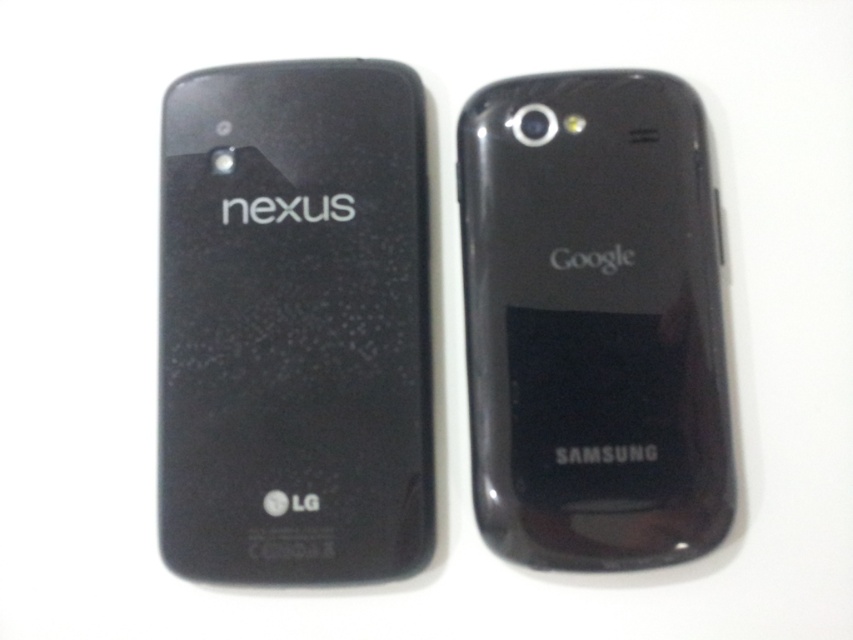
Question: Is matte black nexus phone at left to the right of glossy black phone at center from the viewer's perspective?

Choices:
 (A) yes
 (B) no

Answer: (B)

Question: Does matte black nexus phone at left have a lesser width compared to glossy black phone at center?

Choices:
 (A) yes
 (B) no

Answer: (B)

Question: Which point is farther to the camera?

Choices:
 (A) (415, 388)
 (B) (564, 372)

Answer: (A)

Question: Is matte black nexus phone at left to the right of glossy black phone at center from the viewer's perspective?

Choices:
 (A) no
 (B) yes

Answer: (A)